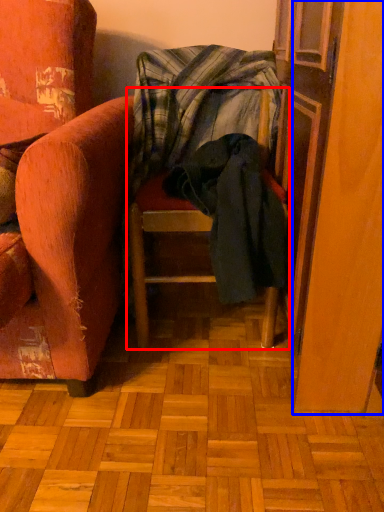
Question: Which of the following is the farthest to the observer, furniture (highlighted by a red box) or screen door (highlighted by a blue box)?

Choices:
 (A) furniture
 (B) screen door

Answer: (A)